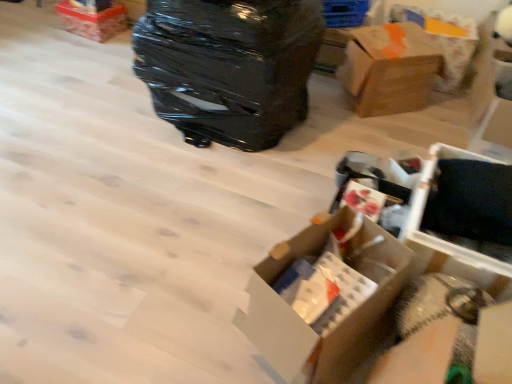
Question: Is brown cardboard box at upper right, the third box when ordered from left to right, inside or outside of white plastic storage box at lower right, the first storage box in the front-to-back sequence?

Choices:
 (A) outside
 (B) inside

Answer: (A)

Question: Considering the positions of brown cardboard box at upper right, which is the 2th box in back-to-front order, and white plastic storage box at lower right, the first storage box in the front-to-back sequence, in the image, is brown cardboard box at upper right, which is the 2th box in back-to-front order, taller or shorter than white plastic storage box at lower right, the first storage box in the front-to-back sequence,?

Choices:
 (A) short
 (B) tall

Answer: (B)

Question: Which object is positioned closest to the matte cardboard box at upper left, the 3th box in the front-to-back sequence?

Choices:
 (A) white plastic storage box at lower right, which is the second storage box in top-to-bottom order
 (B) cardboard box at upper right
 (C) white cardboard box at center, the 1th box in the bottom-to-top sequence
 (D) blue plastic storage box at upper center, positioned as the second storage box in bottom-to-top order
 (E) black plastic suitcase at upper center

Answer: (E)

Question: Which is farther from the white plastic storage box at lower right, placed as the first storage box when sorted from bottom to top?

Choices:
 (A) matte cardboard box at upper left, the 3th box in the front-to-back sequence
 (B) cardboard box at upper right
 (C) black plastic suitcase at upper center
 (D) white cardboard box at center, the 1th box in the bottom-to-top sequence
 (E) brown cardboard box at upper right, which is the 2th box in back-to-front order

Answer: (A)